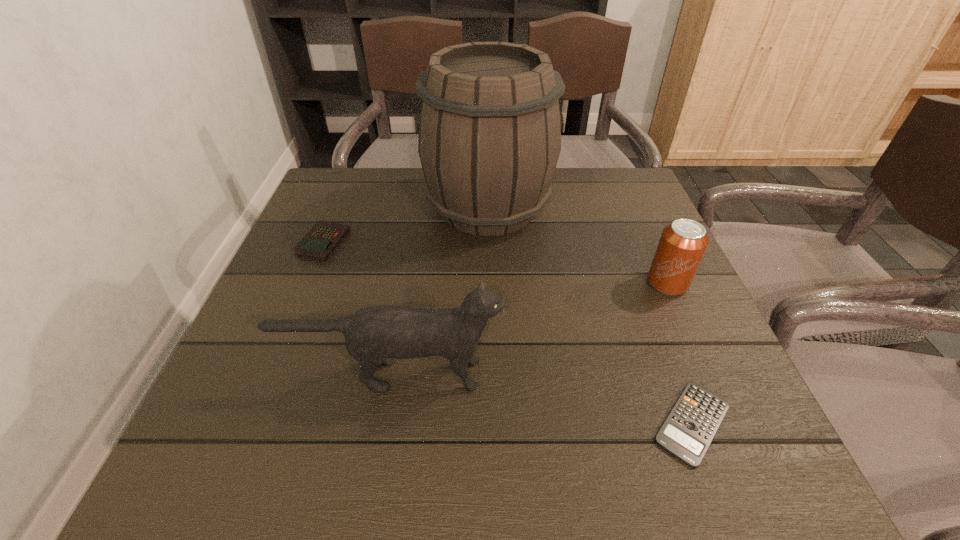
Find the location of a particular element. The image size is (960, 540). free spot that satisfies the following two spatial constraints: 1. on the back side of the shorter calculator; 2. on the left side of the can is located at coordinates (639, 283).